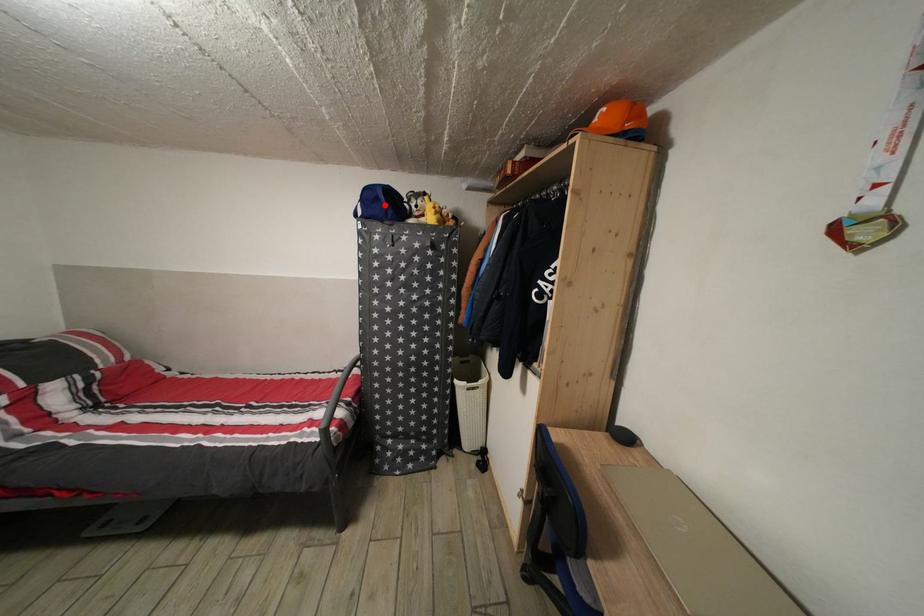
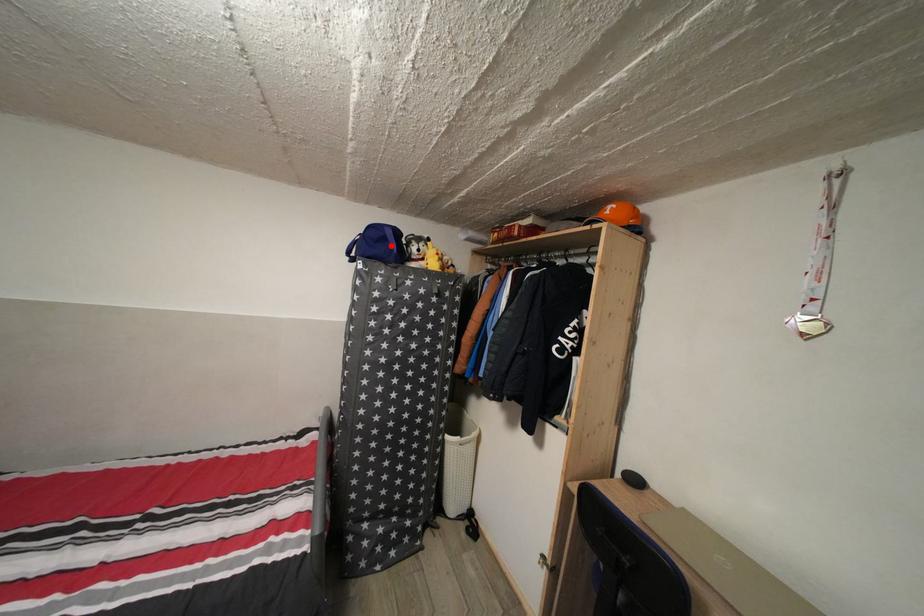
I am providing you with two images of the same scene from different viewpoints. A red point is marked on the first image and another point is marked on the second image. Is the red point in image1 aligned with the point shown in image2?

Yes